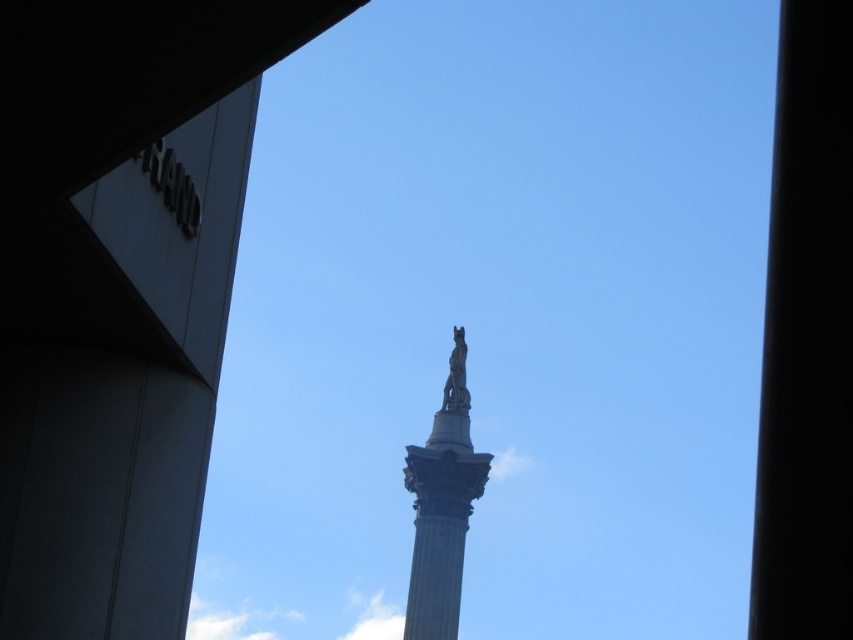
Question: Is black marble column at center positioned in front of polished bronze statue at center?

Choices:
 (A) no
 (B) yes

Answer: (B)

Question: Estimate the real-world distances between objects in this image. Which object is farther from the polished stone column at upper center?

Choices:
 (A) black marble column at center
 (B) polished stone column at center

Answer: (B)

Question: Which object is the farthest from the polished stone column at upper center?

Choices:
 (A) black marble column at center
 (B) polished stone column at center
 (C) polished bronze statue at center

Answer: (C)

Question: Considering the real-world distances, which object is farthest from the polished stone column at center?

Choices:
 (A) black marble column at center
 (B) polished stone column at upper center
 (C) polished bronze statue at center

Answer: (A)

Question: Does polished stone column at upper center have a greater width compared to black marble column at center?

Choices:
 (A) no
 (B) yes

Answer: (B)

Question: Does polished stone column at upper center appear under black marble column at center?

Choices:
 (A) no
 (B) yes

Answer: (A)